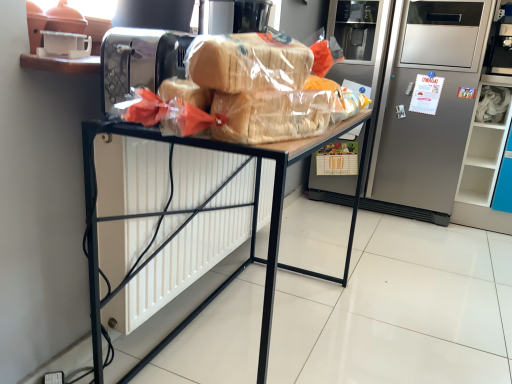
Question: Is satin silver refrigerator at center positioned with its back to wooden desk at center?

Choices:
 (A) no
 (B) yes

Answer: (A)

Question: Considering the relative sizes of satin silver refrigerator at center and wooden desk at center in the image provided, is satin silver refrigerator at center taller than wooden desk at center?

Choices:
 (A) no
 (B) yes

Answer: (B)

Question: Is wooden desk at center completely or partially inside satin silver refrigerator at center?

Choices:
 (A) no
 (B) yes

Answer: (A)

Question: Is satin silver refrigerator at center oriented towards wooden desk at center?

Choices:
 (A) no
 (B) yes

Answer: (B)

Question: Is satin silver refrigerator at center thinner than wooden desk at center?

Choices:
 (A) no
 (B) yes

Answer: (A)

Question: From the image's perspective, relative to wooden desk at center, is satin silver refrigerator at center above or below?

Choices:
 (A) above
 (B) below

Answer: (A)

Question: Is satin silver refrigerator at center wider or thinner than wooden desk at center?

Choices:
 (A) thin
 (B) wide

Answer: (B)

Question: Is point (462, 56) positioned closer to the camera than point (281, 148)?

Choices:
 (A) farther
 (B) closer

Answer: (A)

Question: Would you say satin silver refrigerator at center is to the left or to the right of wooden desk at center in the picture?

Choices:
 (A) right
 (B) left

Answer: (A)

Question: From a real-world perspective, is satin silver refrigerator at center above or below translucent plastic bread at center?

Choices:
 (A) above
 (B) below

Answer: (B)

Question: Considering the positions of satin silver refrigerator at center and translucent plastic bread at center in the image, is satin silver refrigerator at center bigger or smaller than translucent plastic bread at center?

Choices:
 (A) big
 (B) small

Answer: (A)

Question: From the image's perspective, is satin silver refrigerator at center located above or below translucent plastic bread at center?

Choices:
 (A) above
 (B) below

Answer: (A)

Question: Considering the positions of point (392, 124) and point (328, 117), is point (392, 124) closer or farther from the camera than point (328, 117)?

Choices:
 (A) farther
 (B) closer

Answer: (A)

Question: Considering the positions of translucent plastic bread at center and satin silver refrigerator at center in the image, is translucent plastic bread at center bigger or smaller than satin silver refrigerator at center?

Choices:
 (A) big
 (B) small

Answer: (B)

Question: Is translucent plastic bread at center to the left or to the right of satin silver refrigerator at center in the image?

Choices:
 (A) right
 (B) left

Answer: (B)